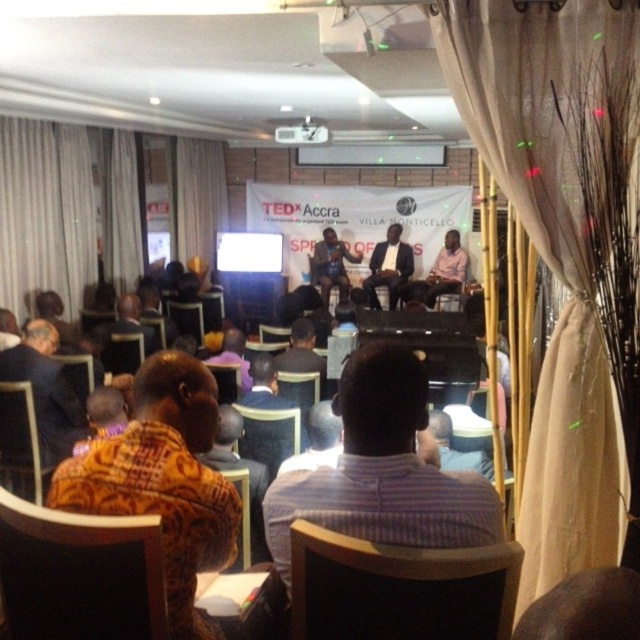
Is point (380, 576) positioned before point (257, 449)?

Yes, point (380, 576) is closer to viewer.

Is black fabric chair at lower center to the right of wooden chair at center from the viewer's perspective?

Yes, black fabric chair at lower center is to the right of wooden chair at center.

Is point (396, 595) positioned before point (275, 461)?

Yes, it is.

This screenshot has width=640, height=640. Find the location of `black fabric chair at lower center`. black fabric chair at lower center is located at coordinates (397, 588).

Consider the image. Does patterned fabric shirt at left appear on the right side of matte black shirt at center?

In fact, patterned fabric shirt at left is to the left of matte black shirt at center.

Is patterned fabric shirt at left above matte black shirt at center?

No.

Is point (61, 419) positioned in front of point (333, 273)?

Yes, it is in front of point (333, 273).

Find the location of `patterned fabric shirt at left`. patterned fabric shirt at left is located at coordinates (45, 390).

Is wooden at left further to the viewer compared to printed fabric shirt at center?

No, it is in front of printed fabric shirt at center.

Between wooden at left and printed fabric shirt at center, which one has more height?

wooden at left is taller.

Who is more forward, (33, 486) or (136, 307)?

Point (33, 486) is in front.

I want to click on wooden at left, so pyautogui.click(x=20, y=442).